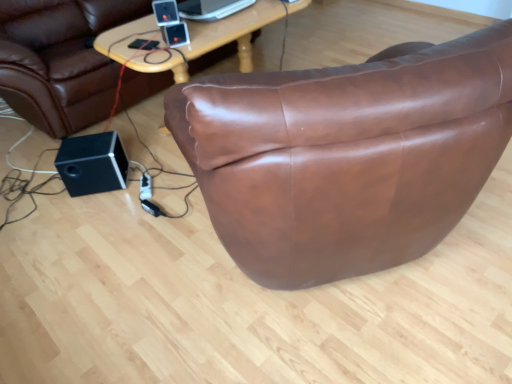
Question: Considering the positions of black matte speaker at lower left, which is the second speaker in front-to-back order, and satin black ipod at upper center in the image, is black matte speaker at lower left, which is the second speaker in front-to-back order, bigger or smaller than satin black ipod at upper center?

Choices:
 (A) big
 (B) small

Answer: (A)

Question: From a real-world perspective, is black matte speaker at lower left, which is the second speaker in front-to-back order, physically located above or below satin black ipod at upper center?

Choices:
 (A) below
 (B) above

Answer: (A)

Question: Estimate the real-world distances between objects in this image. Which object is closer to the satin black ipod at upper center?

Choices:
 (A) black matte speaker at lower left, which is the second speaker in right-to-left order
 (B) brown leather bean bag chair at center
 (C) black plastic speaker at upper center, which is counted as the second speaker, starting from the back

Answer: (C)

Question: Estimate the real-world distances between objects in this image. Which object is farther from the brown leather bean bag chair at center?

Choices:
 (A) black matte speaker at lower left, which is the 1th speaker from bottom to top
 (B) black plastic speaker at upper center, which is counted as the second speaker, starting from the back
 (C) satin black ipod at upper center

Answer: (C)